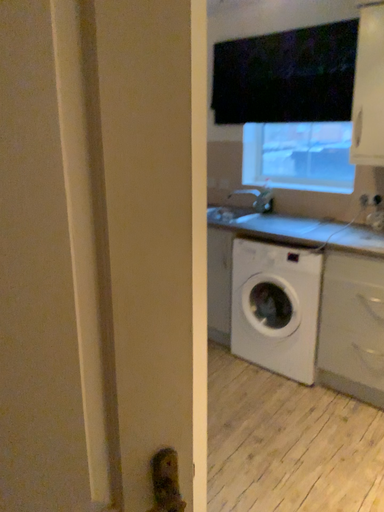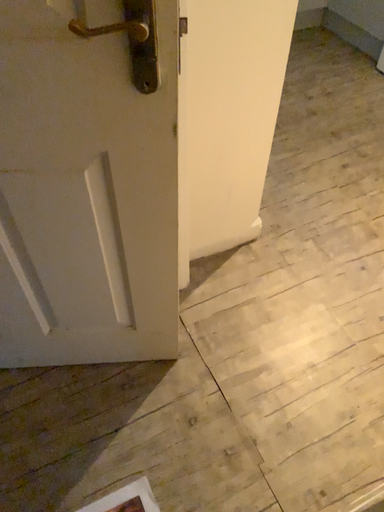
Question: How did the camera likely rotate when shooting the video?

Choices:
 (A) rotated downward
 (B) rotated upward

Answer: (A)